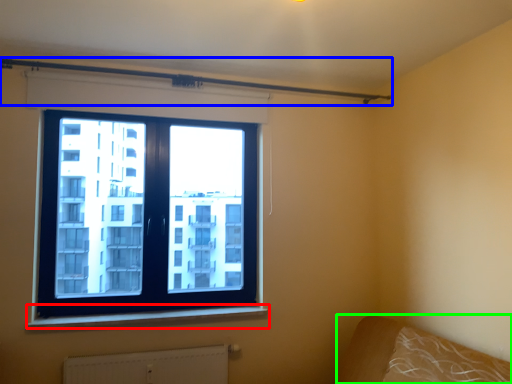
Question: Which object is the closest to the window sill (highlighted by a red box)? Choose among these: beam (highlighted by a blue box) or bed frame (highlighted by a green box).

Choices:
 (A) beam
 (B) bed frame

Answer: (B)